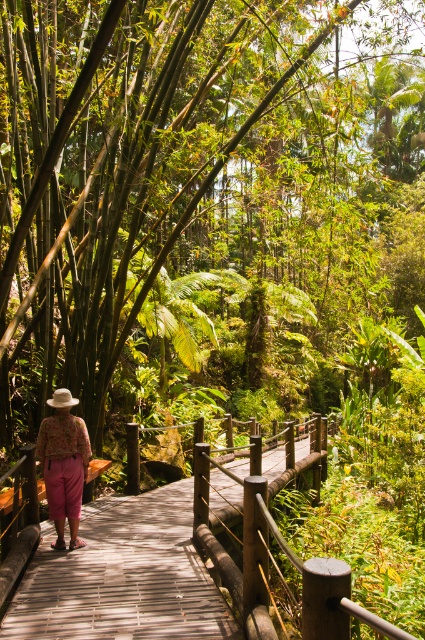
You are a hiker walking along the boardwalk in the tropical forest. You notice the wooden bridge at center and the floral fabric pants at center. Which object is closer to you as you face the boardwalk?

The wooden bridge at center is closer to you because the floral fabric pants at center is behind it.

You are a hiker who wants to cross the wooden bridge at center while wearing the floral fabric pants at center. Can you safely walk across the bridge without the pants getting caught?

The wooden bridge at center is shorter than the floral fabric pants at center, so the pants may drag and get caught on the bridge. It is not recommended to cross while wearing the floral fabric pants at center.